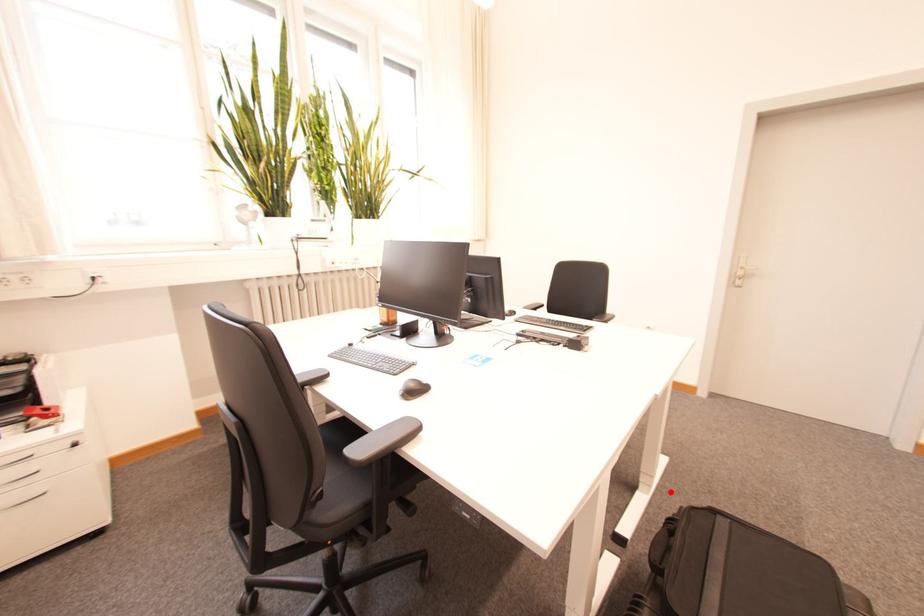
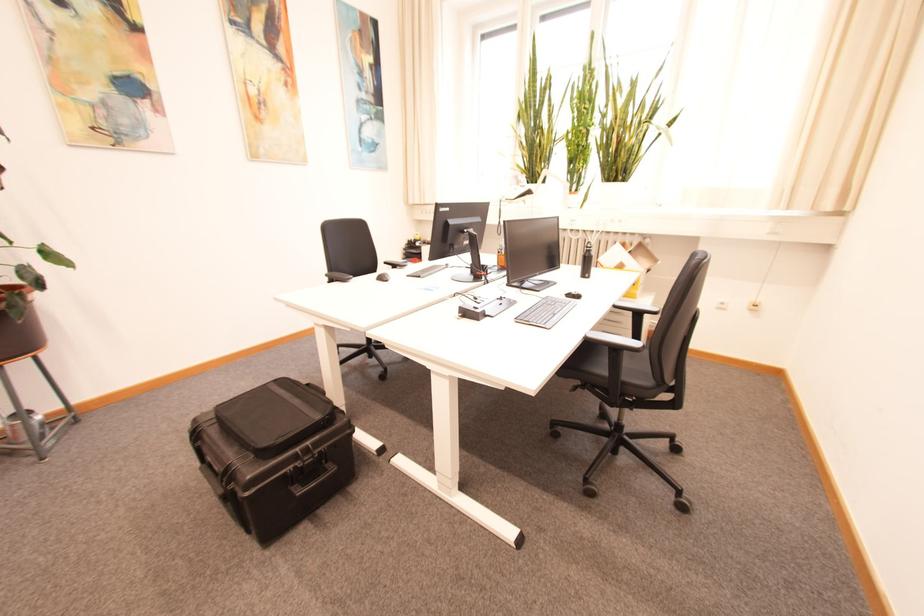
Question: I am providing you with two images of the same scene from different viewpoints. Given a red point in image1, look at the same physical point in image2. Is it:

Choices:
 (A) Closer to the viewpoint
 (B) Farther from the viewpoint

Answer: (B)